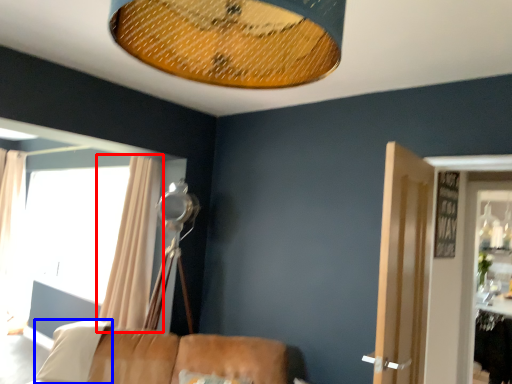
Question: Which object is closer to the camera taking this photo, curtain (highlighted by a red box) or pillow (highlighted by a blue box)?

Choices:
 (A) curtain
 (B) pillow

Answer: (B)